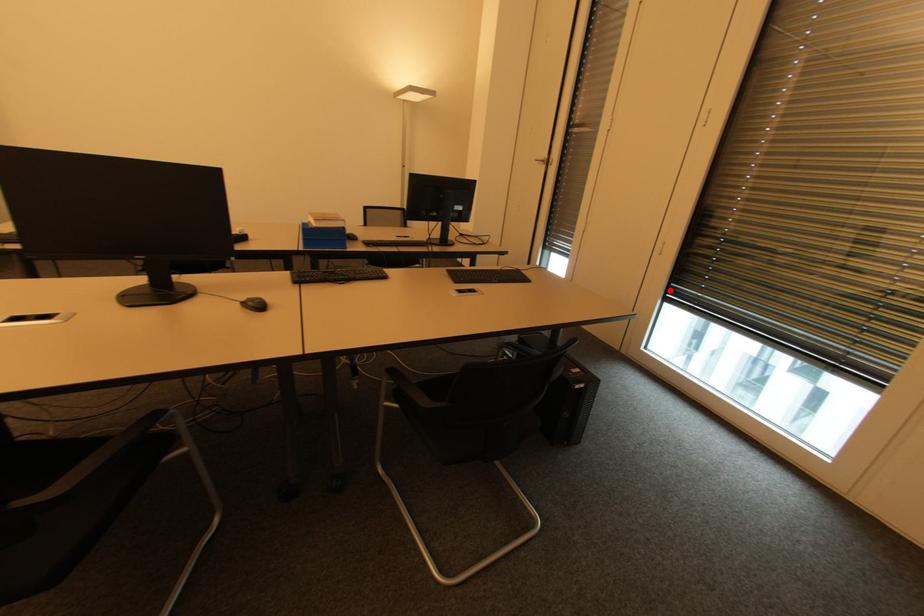
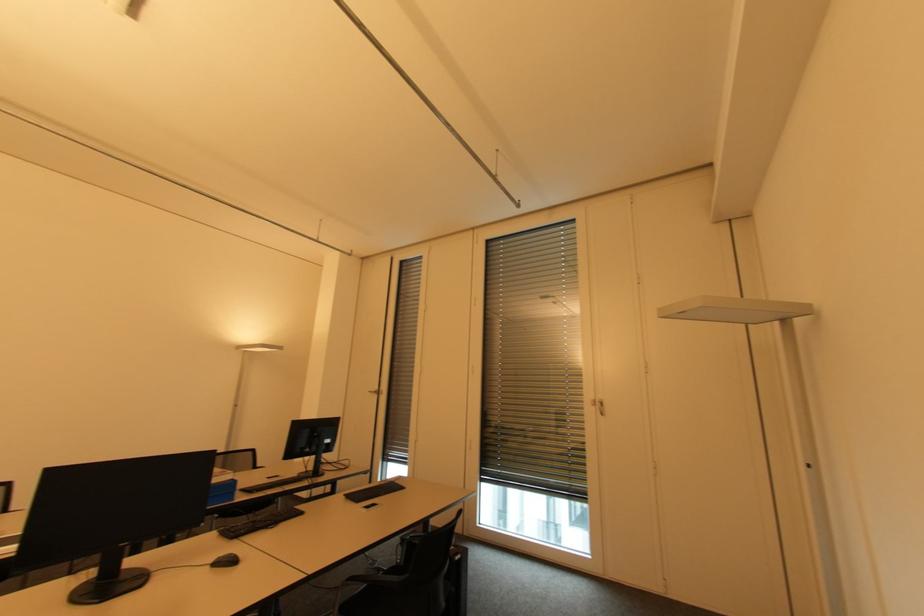
In the second image, find the point that corresponds to the highlighted location in the first image.

(483, 474)